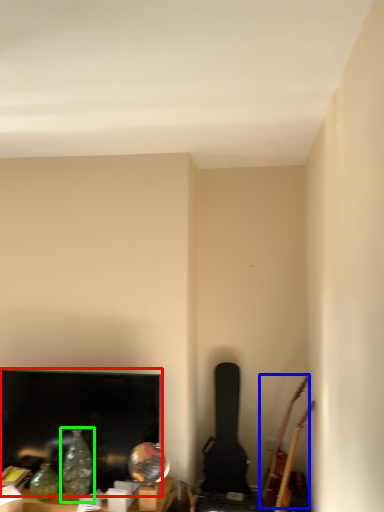
Question: Which object is the farthest from television (highlighted by a red box)? Choose among these: guitar (highlighted by a blue box) or glass vase (highlighted by a green box).

Choices:
 (A) guitar
 (B) glass vase

Answer: (A)